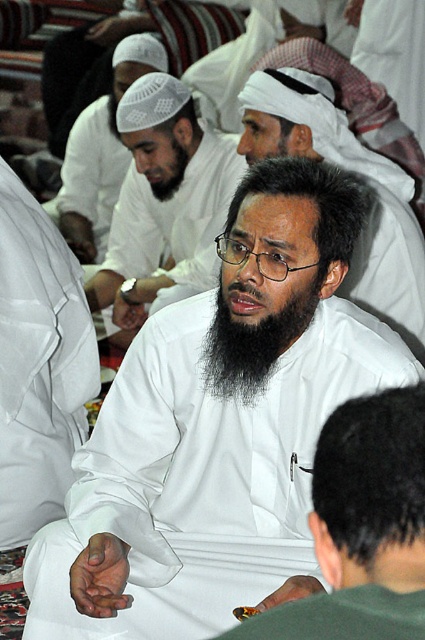
Which of these two, white matte clothing at center or white matte headscarf at upper center, stands taller?

Standing taller between the two is white matte headscarf at upper center.

Is point (138, 440) closer to viewer compared to point (82, 209)?

That is True.

Between point (64, 541) and point (110, 150), which one is positioned in front?

Point (64, 541)

Locate an element on the screen. white matte clothing at center is located at coordinates (218, 428).

Describe the element at coordinates (218, 428) in the screenshot. The width and height of the screenshot is (425, 640). I see `white matte clothing at center` at that location.

Who is more distant from viewer, (235,276) or (248,624)?

The point (235,276) is behind.

Which is in front, point (99, 616) or point (334, 557)?

Point (334, 557)

You are a GUI agent. You are given a task and a screenshot of the screen. Output one action in this format:
    pyautogui.click(x=<x>, y=<y>)
    Task: Click on the white matte clothing at center
    
    Given the screenshot: What is the action you would take?
    pyautogui.click(x=218, y=428)

Is white matte shirt at center taller than white matte/soft headscarf at center?

No.

Which is more to the left, white matte shirt at center or white matte/soft headscarf at center?

white matte shirt at center

Between point (391, 557) and point (302, 106), which one is positioned behind?

The point (302, 106) is behind.

Where is `white matte shirt at center`? The height and width of the screenshot is (640, 425). white matte shirt at center is located at coordinates (362, 525).